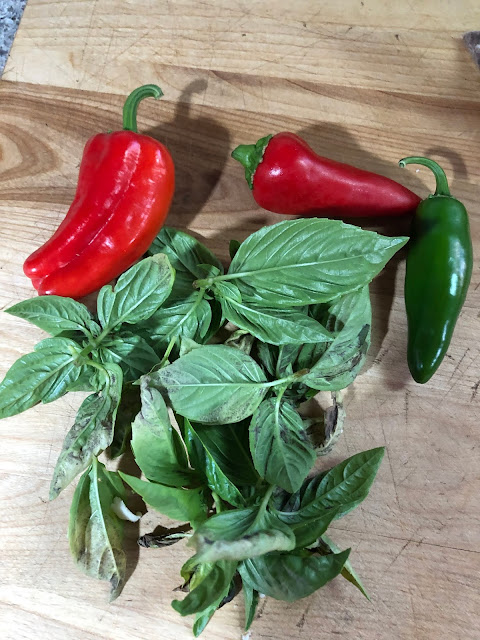
At what (x,y) coordinates should I click in order to perform the action: click on natural wood pattern. Please return your answer as a coordinate pair (x, y). Looking at the image, I should click on (25, 146), (41, 156).